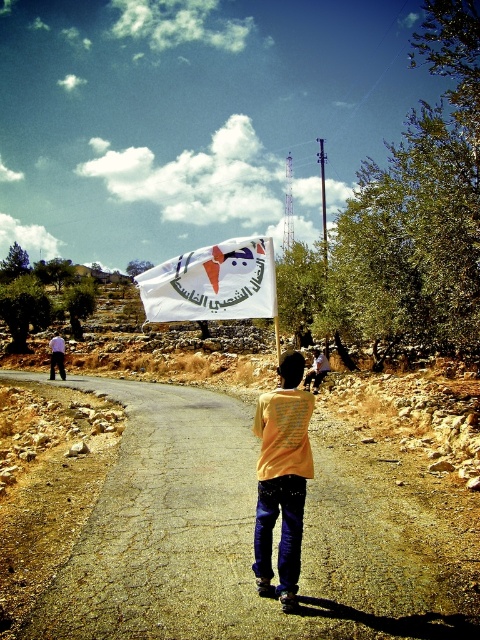
You are a photographer trying to capture the boy in the scene. You want to ensure both the yellow matte shirt at center and the white fabric flag at center are clearly visible in your photo. Which object should you focus on first to ensure both are in focus?

You should focus on the yellow matte shirt at center first because it is closer to the viewer than the white fabric flag at center. By focusing on the closer object, the flag will also be in focus due to the depth of field.

You are a photographer trying to capture the boy in the scene. You want to ensure both the yellow matte shirt at center and the white fabric flag at center are visible in your shot. Which object should you focus on first to frame them properly?

You should focus on the white fabric flag at center first because the yellow matte shirt at center is positioned to its right, so centering the flag will help include the shirt in the frame.